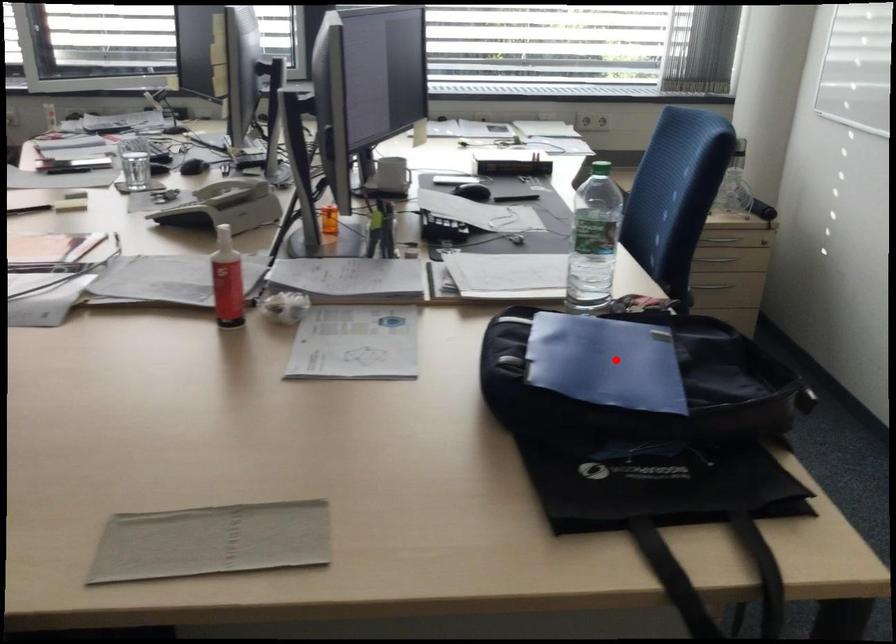
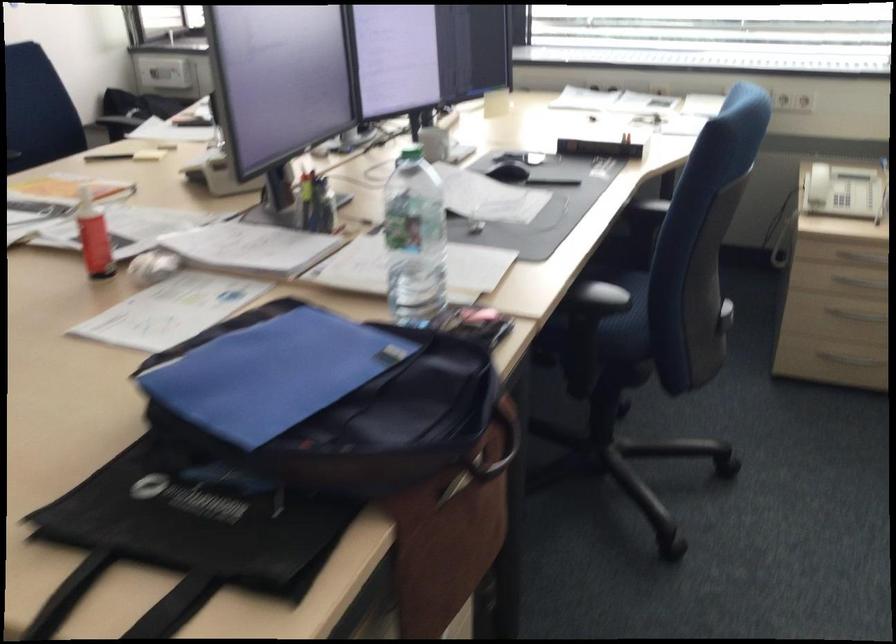
Question: I am providing you with two images of the same scene from different viewpoints. Given a red point in image1, look at the same physical point in image2. Is it:

Choices:
 (A) Closer to the viewpoint
 (B) Farther from the viewpoint

Answer: (A)